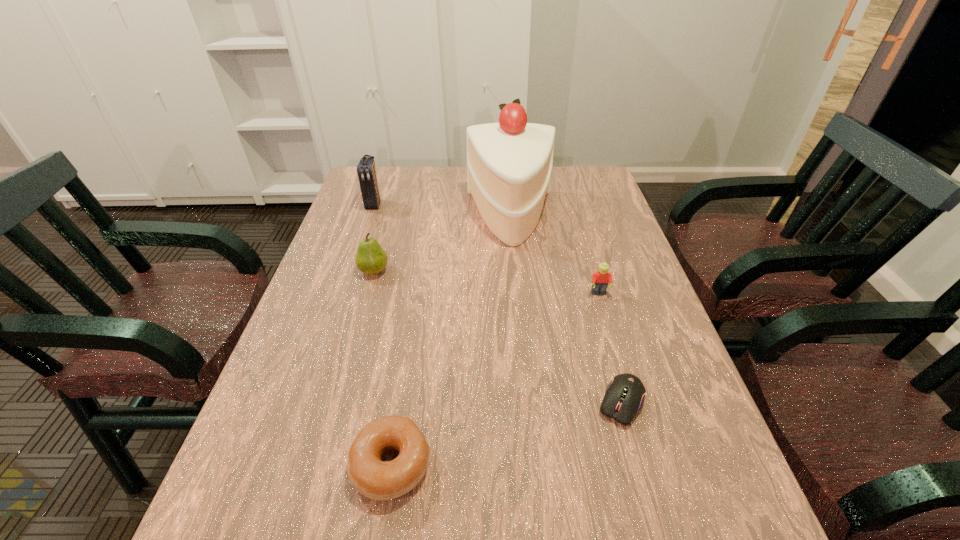
You are a GUI agent. You are given a task and a screenshot of the screen. Output one action in this format:
    pyautogui.click(x=<x>, y=<y>)
    Task: Click on the free spot that satisfies the following two spatial constraints: 1. with the zip open on the third tallest object; 2. on the left side of the fifth shortest object
    Image resolution: width=960 pixels, height=540 pixels.
    Given the screenshot: What is the action you would take?
    pyautogui.click(x=351, y=271)